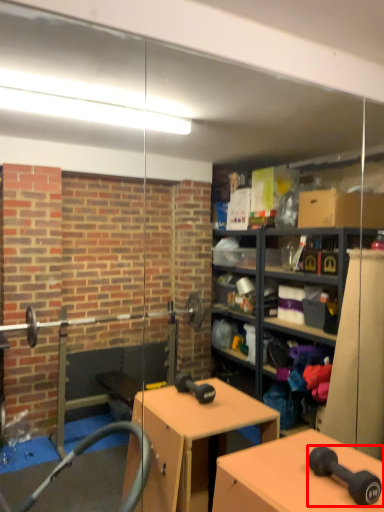
Question: Observing the image, what is the correct spatial positioning of dumbbell (annotated by the red box) in reference to table?

Choices:
 (A) left
 (B) right

Answer: (B)